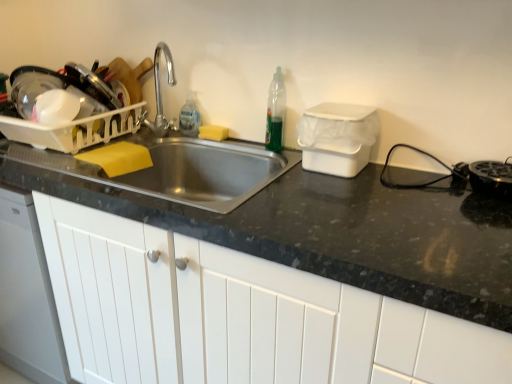
Question: From the image's perspective, would you say white plastic dish rack at left, which ranks as the first appliance in left-to-right order, is shown under black plastic toaster at right, the 1th appliance from the right?

Choices:
 (A) yes
 (B) no

Answer: (B)

Question: Would you say black plastic toaster at right, the 3th appliance positioned from the left, is part of white plastic dish rack at left, which ranks as the first appliance in left-to-right order,'s contents?

Choices:
 (A) yes
 (B) no

Answer: (B)

Question: Considering the relative sizes of white plastic dish rack at left, placed as the 3th appliance when sorted from right to left, and black plastic toaster at right, the 3th appliance positioned from the left, in the image provided, is white plastic dish rack at left, placed as the 3th appliance when sorted from right to left, wider than black plastic toaster at right, the 3th appliance positioned from the left,?

Choices:
 (A) no
 (B) yes

Answer: (B)

Question: From the image's perspective, does white plastic dish rack at left, placed as the 3th appliance when sorted from right to left, appear higher than black plastic toaster at right, the 1th appliance from the right?

Choices:
 (A) yes
 (B) no

Answer: (A)

Question: Is white plastic dish rack at left, which ranks as the first appliance in left-to-right order, positioned far away from black plastic toaster at right, the 1th appliance from the right?

Choices:
 (A) yes
 (B) no

Answer: (A)

Question: From a real-world perspective, is black plastic toaster at right, the 3th appliance positioned from the left, positioned above or below translucent plastic bottle at sink, which is counted as the first bottle, starting from the back?

Choices:
 (A) above
 (B) below

Answer: (B)

Question: Considering the relative positions of black plastic toaster at right, the 1th appliance from the right, and translucent plastic bottle at sink, the first bottle from the left, in the image provided, is black plastic toaster at right, the 1th appliance from the right, to the left or to the right of translucent plastic bottle at sink, the first bottle from the left,?

Choices:
 (A) right
 (B) left

Answer: (A)

Question: Considering the positions of point tap(470, 178) and point tap(187, 132), is point tap(470, 178) closer or farther from the camera than point tap(187, 132)?

Choices:
 (A) closer
 (B) farther

Answer: (A)

Question: Relative to translucent plastic bottle at sink, which is counted as the first bottle, starting from the back, is black plastic toaster at right, the 3th appliance positioned from the left, in front or behind?

Choices:
 (A) behind
 (B) front

Answer: (B)

Question: Which is correct: yellow sponge at sink is inside white matte cabinet at center, or outside of it?

Choices:
 (A) inside
 (B) outside

Answer: (B)

Question: Considering the positions of point (203, 137) and point (471, 329), is point (203, 137) closer or farther from the camera than point (471, 329)?

Choices:
 (A) closer
 (B) farther

Answer: (B)

Question: Considering the positions of yellow sponge at sink and white matte cabinet at center in the image, is yellow sponge at sink bigger or smaller than white matte cabinet at center?

Choices:
 (A) big
 (B) small

Answer: (B)

Question: Relative to white matte cabinet at center, is yellow sponge at sink in front or behind?

Choices:
 (A) behind
 (B) front

Answer: (A)

Question: Looking at their shapes, would you say translucent plastic bottle at sink, which is counted as the first bottle, starting from the back, is wider or thinner than black plastic toaster at right, the 1th appliance from the right?

Choices:
 (A) wide
 (B) thin

Answer: (B)

Question: Is translucent plastic bottle at sink, the first bottle from the left, to the left or to the right of black plastic toaster at right, the 3th appliance positioned from the left, in the image?

Choices:
 (A) left
 (B) right

Answer: (A)